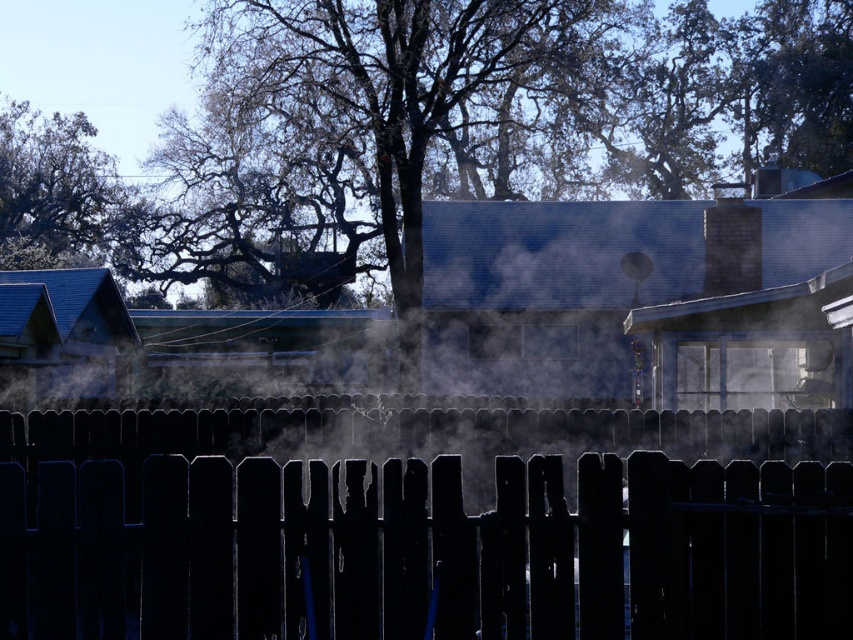
At what (x,y) coordinates should I click in order to perform the action: click on black wood fence at center. Please return your answer as a coordinate pair (x, y). This screenshot has width=853, height=640. Looking at the image, I should click on (416, 547).